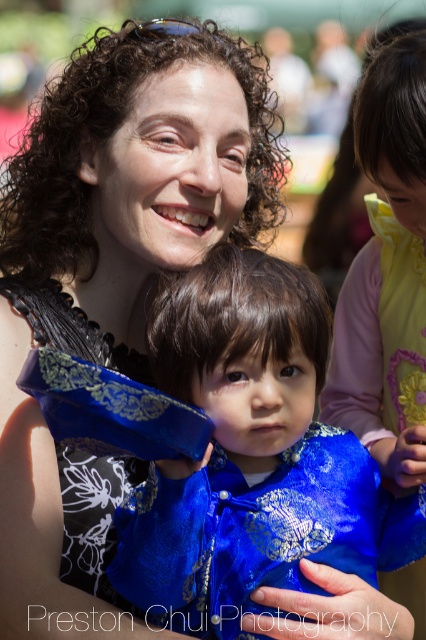
Question: Does matte black dress at upper left have a lesser width compared to blue silk kimono at center?

Choices:
 (A) yes
 (B) no

Answer: (B)

Question: Considering the real-world distances, which object is closest to the matte black dress at upper left?

Choices:
 (A) blue silk dress at upper right
 (B) blue silk kimono at center

Answer: (B)

Question: Is blue silk kimono at center positioned behind blue silk dress at upper right?

Choices:
 (A) yes
 (B) no

Answer: (B)

Question: Estimate the real-world distances between objects in this image. Which object is farther from the blue silk kimono at center?

Choices:
 (A) blue silk dress at upper right
 (B) matte black dress at upper left

Answer: (A)

Question: Which point is farther from the camera taking this photo?

Choices:
 (A) (77, 460)
 (B) (319, 440)
 (C) (419, 584)

Answer: (C)

Question: Can you confirm if matte black dress at upper left is positioned above blue silk kimono at center?

Choices:
 (A) yes
 (B) no

Answer: (A)